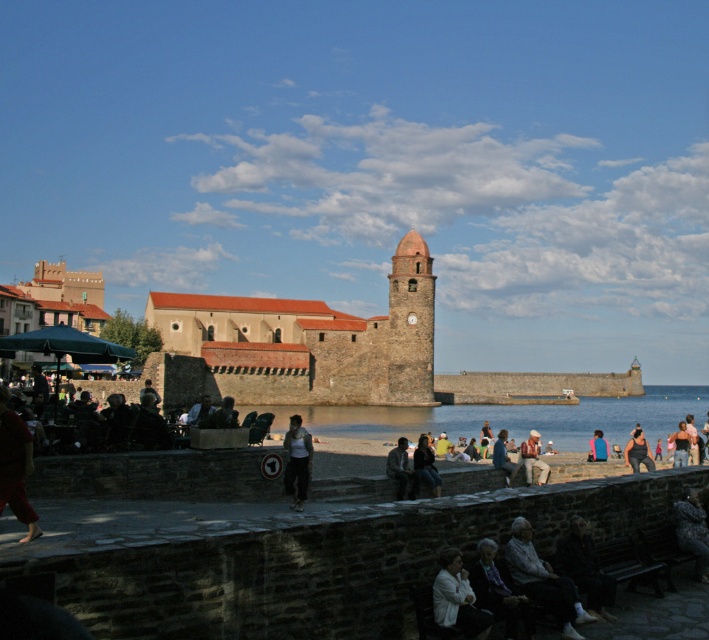
You are standing at the camera position and want to reach the smooth stone clock tower at center. The path is clear, but you have a 100 feet long rope. Can you reach the tower using the rope?

The smooth stone clock tower at center is 396.24 feet away from camera. Since the rope is only 100 feet long, it is not long enough to reach the tower.

In the scene shown: You are a photographer standing at the coastal scene. You notice a white cotton shirt at center and a denim jacket at center. Which clothing item is covering the other one?

The white cotton shirt at center is positioned over the denim jacket at center, so it is covering the denim jacket at center.

You are standing at the viewing point overlooking the coastal scene. You notice a white cotton shirt at center in the distance. If you want to reach it quickly, should you walk towards the stone wall or the beach?

The white cotton shirt at center is 62.45 meters away from viewer. Since the shirt is at the center of the scene, walking towards the beach would be the most direct path as the wall is in the foreground and the shirt is likely positioned further out towards the beach area.